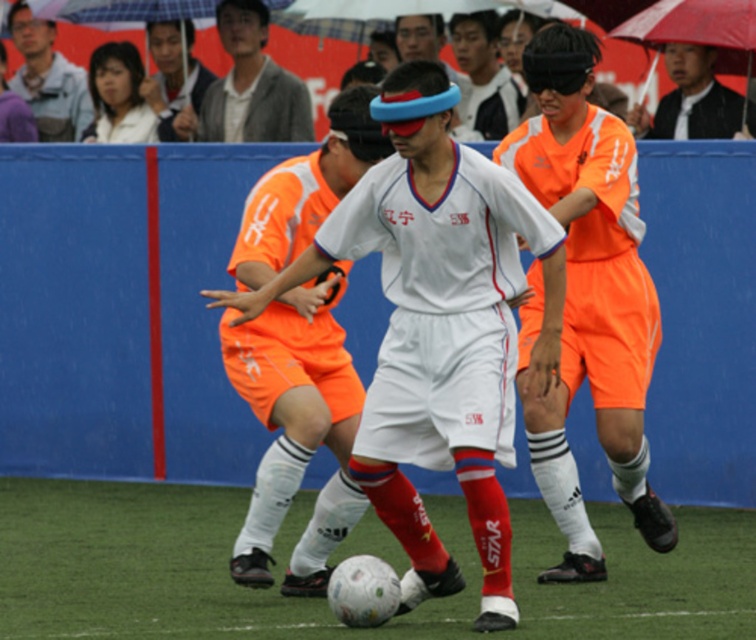
You are a soccer coach analyzing the game. You notice the orange jersey at center and the green grass at center in the image. Which object is positioned to the left of the other?

The green grass at center is to the left of orange jersey at center.

You are a soccer coach analyzing the field setup. You notice the green grass at center and the orange jersey at center. Which object is wider in this scene?

The green grass at center is wider than the orange jersey at center.